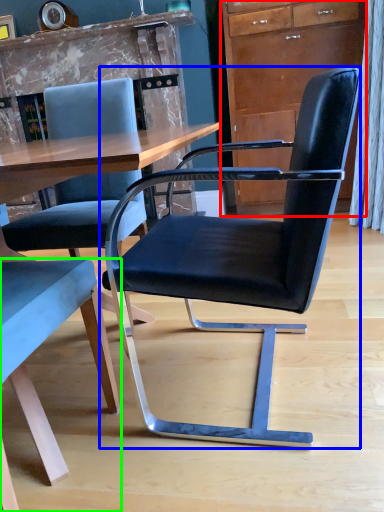
Question: Which object is positioned farthest from cabinetry (highlighted by a red box)? Select from chair (highlighted by a blue box) and chair (highlighted by a green box).

Choices:
 (A) chair
 (B) chair

Answer: (B)